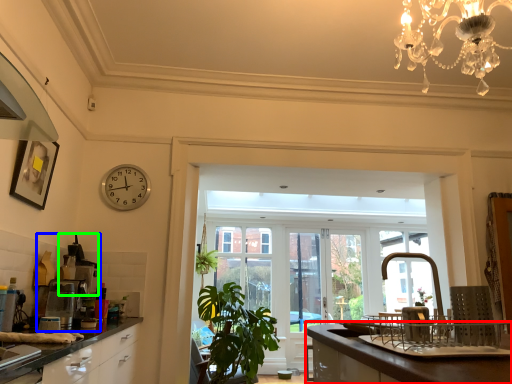
Question: Considering the real-world distances, which object is closest to countertop (highlighted by a red box)? coffee machine (highlighted by a blue box) or appliance (highlighted by a green box).

Choices:
 (A) coffee machine
 (B) appliance

Answer: (A)